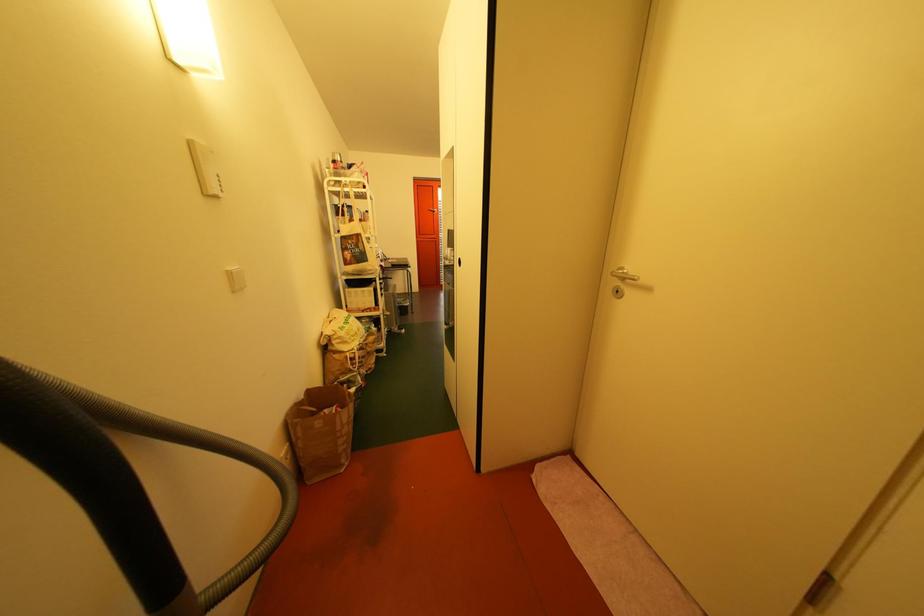
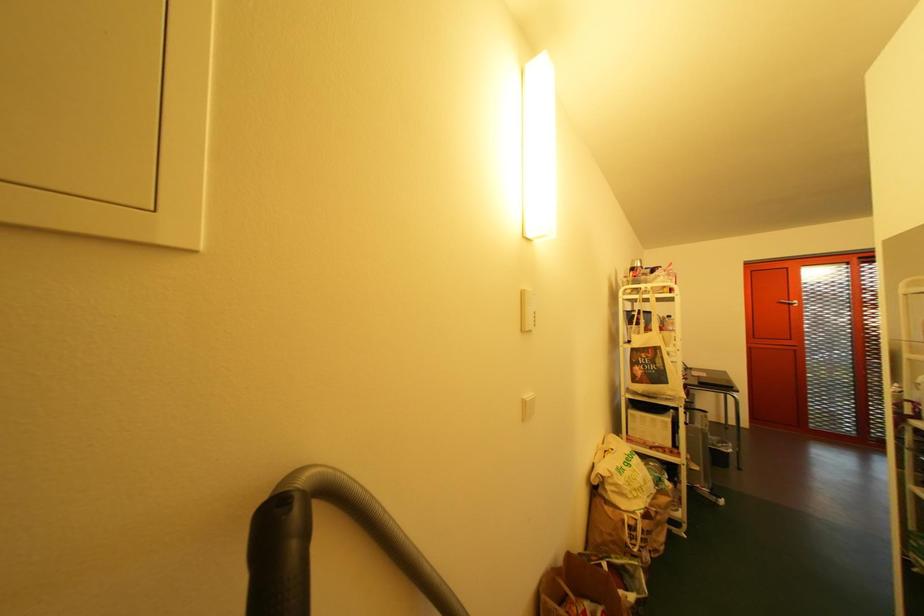
Question: The images are taken continuously from a first-person perspective. In which direction is your viewpoint rotating?

Choices:
 (A) Left
 (B) Right
 (C) Up
 (D) Down

Answer: (A)